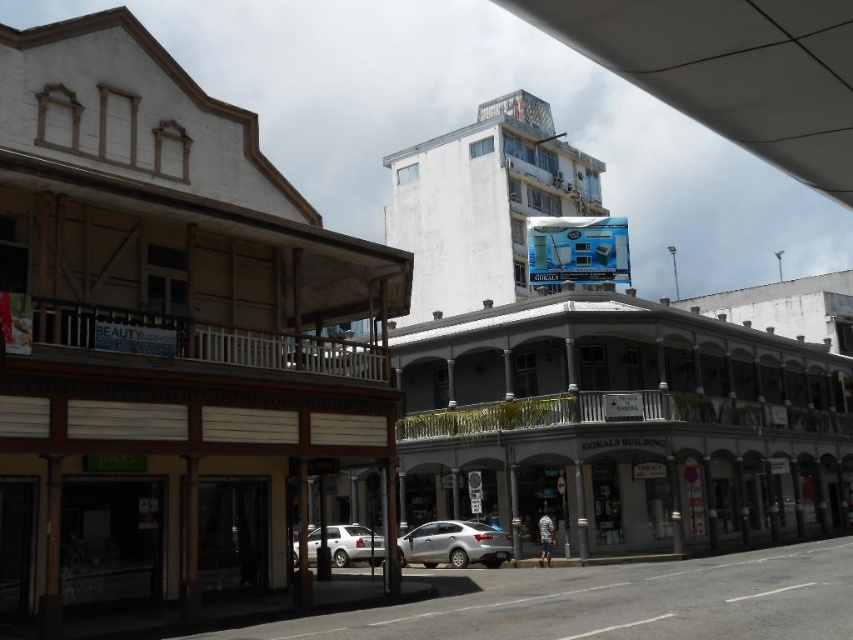
Question: Is silver metallic sedan at center above satin silver car at center?

Choices:
 (A) no
 (B) yes

Answer: (B)

Question: Does silver metallic sedan at center appear under satin silver car at center?

Choices:
 (A) no
 (B) yes

Answer: (A)

Question: Is silver metallic sedan at center below satin silver car at center?

Choices:
 (A) no
 (B) yes

Answer: (A)

Question: Which point appears closest to the camera in this image?

Choices:
 (A) (329, 540)
 (B) (506, 548)

Answer: (B)